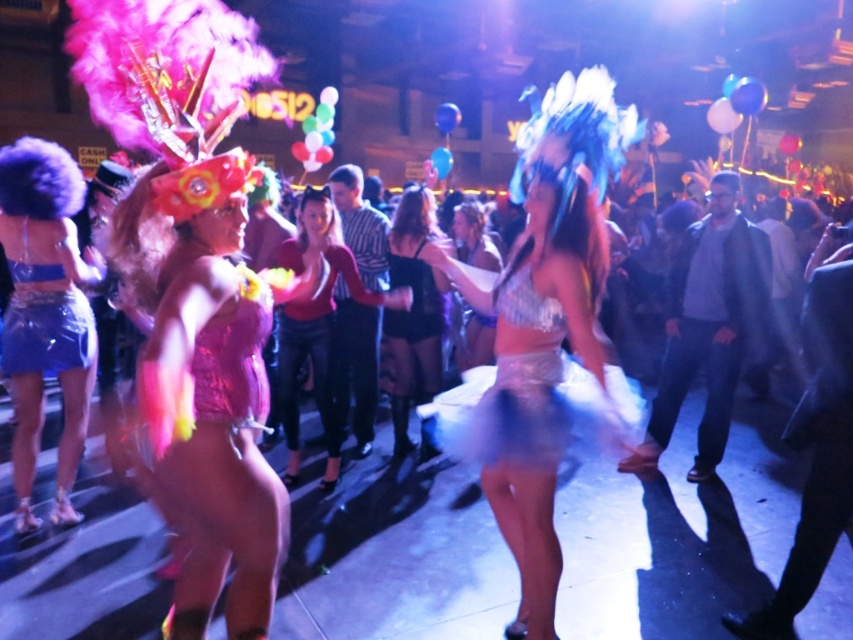
You are standing at the entrance of the event and want to take a photo of the shiny pink sequin dress at center. Given that the entrance is at point 0.0, 0.0, can you estimate if the dress is within a 5 meter radius from you?

The shiny pink sequin dress at center is located at point (206, 404). To determine if it is within a 5 meter radius, we calculate the distance using the Euclidean formula. The distance is sqrt. However, since coordinates are normalized between 0 and 1, the actual distance depends on the room size. Without knowing the room dimensions, we cannot accurately determine if it is within 5 meters. Please provide more information about the room size to proceed.

In the scene shown: You are at a carnival and see two dresses in the center of the image. The shiny pink sequin dress at center and the white sequined dress at center. Which one is positioned to the left?

The shiny pink sequin dress at center is to the left of the white sequined dress at center.